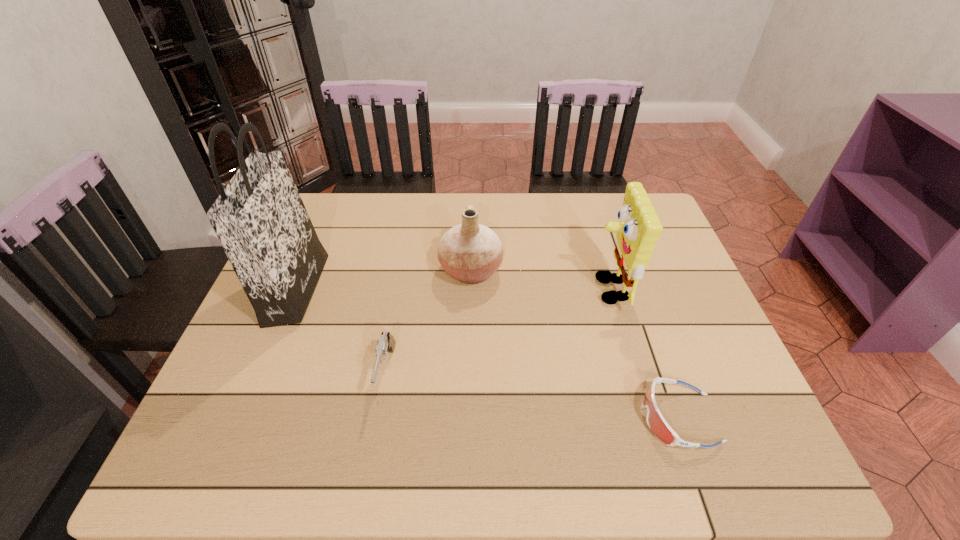
Identify the location of object that is at the near right corner. This screenshot has width=960, height=540. (656, 422).

The width and height of the screenshot is (960, 540). In order to click on vacant space at the far edge of the desktop in this screenshot , I will do `click(496, 199)`.

You are a GUI agent. You are given a task and a screenshot of the screen. Output one action in this format:
    pyautogui.click(x=<x>, y=<y>)
    Task: Click on the vacant area at the near edge of the desktop
    This screenshot has height=540, width=960.
    Given the screenshot: What is the action you would take?
    pyautogui.click(x=656, y=439)

Identify the location of vacant region at the left edge of the desktop. (240, 378).

Locate an element on the screen. free space at the right edge is located at coordinates (679, 416).

This screenshot has height=540, width=960. In the image, there is a desktop. Identify the location of free region at the far left corner. (324, 239).

Image resolution: width=960 pixels, height=540 pixels. I want to click on vacant space at the near left corner of the desktop, so point(208,429).

Where is `vacant point located between the goggles and the second shortest object`? This screenshot has width=960, height=540. vacant point located between the goggles and the second shortest object is located at coordinates (533, 395).

The image size is (960, 540). I want to click on empty space between the tallest object and the shortest object, so click(488, 353).

The height and width of the screenshot is (540, 960). In order to click on vacant region between the goggles and the pottery in this screenshot , I will do `click(575, 344)`.